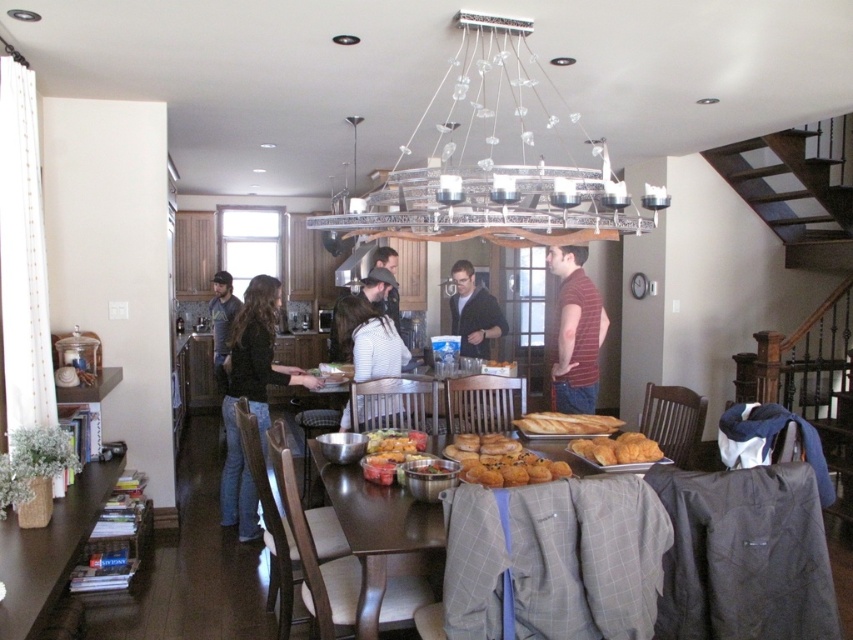
Question: Which object is positioned farthest from the dark blue jeans at center?

Choices:
 (A) dark brown leather jacket at center
 (B) striped t-shirt at center
 (C) dark gray sweater at center

Answer: (B)

Question: Does brown wooden table at lower left have a greater width compared to golden brown crusty bread at center?

Choices:
 (A) no
 (B) yes

Answer: (B)

Question: Which object appears farthest from the camera in this image?

Choices:
 (A) golden brown croissant at center
 (B) shiny metallic bowls at center
 (C) golden brown crusty bread at center
 (D) black sweater at center

Answer: (D)

Question: Can you confirm if clear crystal chandelier at upper center is smaller than golden brown doughnut at center?

Choices:
 (A) no
 (B) yes

Answer: (A)

Question: Does wooden table at center have a greater width compared to golden brown croissant at center?

Choices:
 (A) no
 (B) yes

Answer: (B)

Question: Which point is farther to the camera?

Choices:
 (A) (595, 289)
 (B) (213, 353)
 (C) (344, 316)
 (D) (54, 508)

Answer: (B)